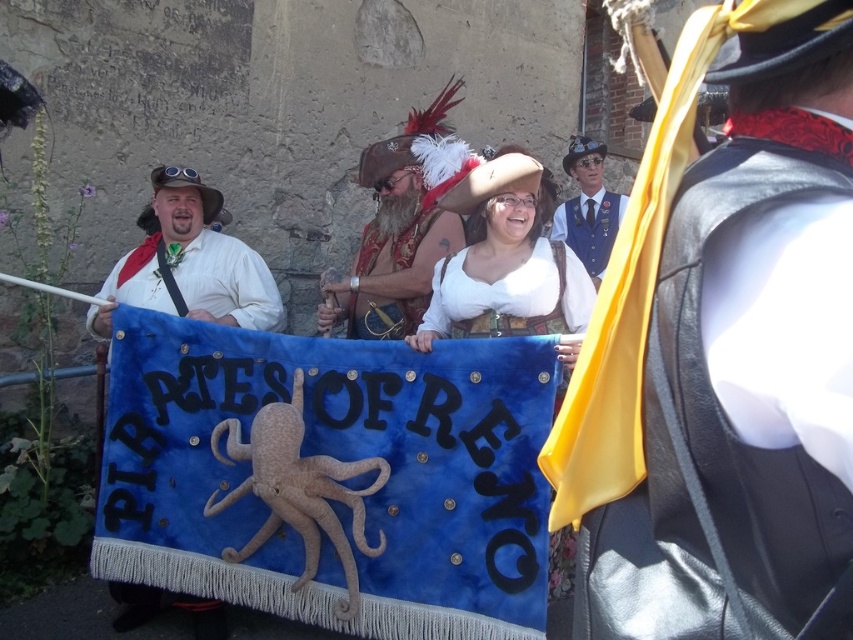
Based on the scene description, where is the white satin blouse at center located in terms of coordinates?

The white satin blouse at center is located at coordinates point [508,266].